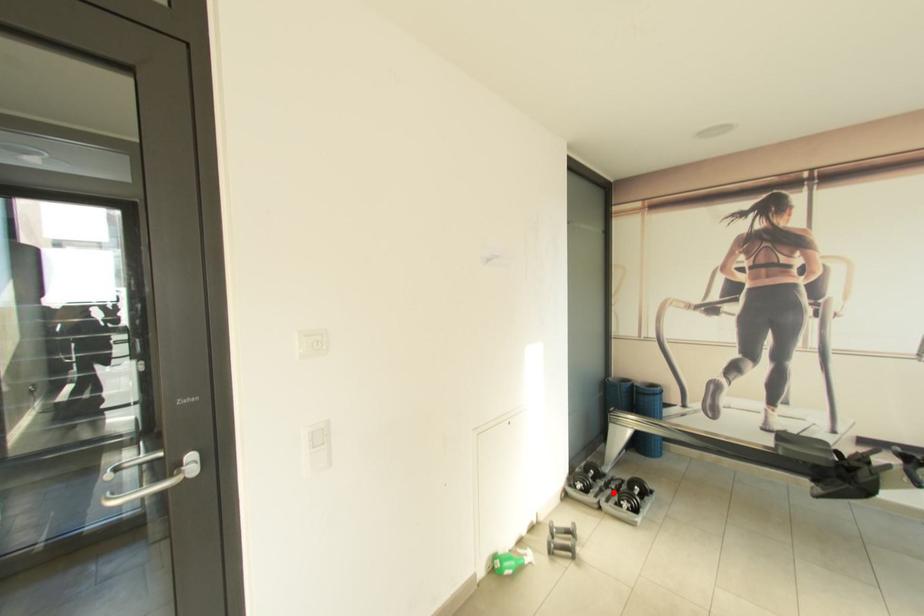
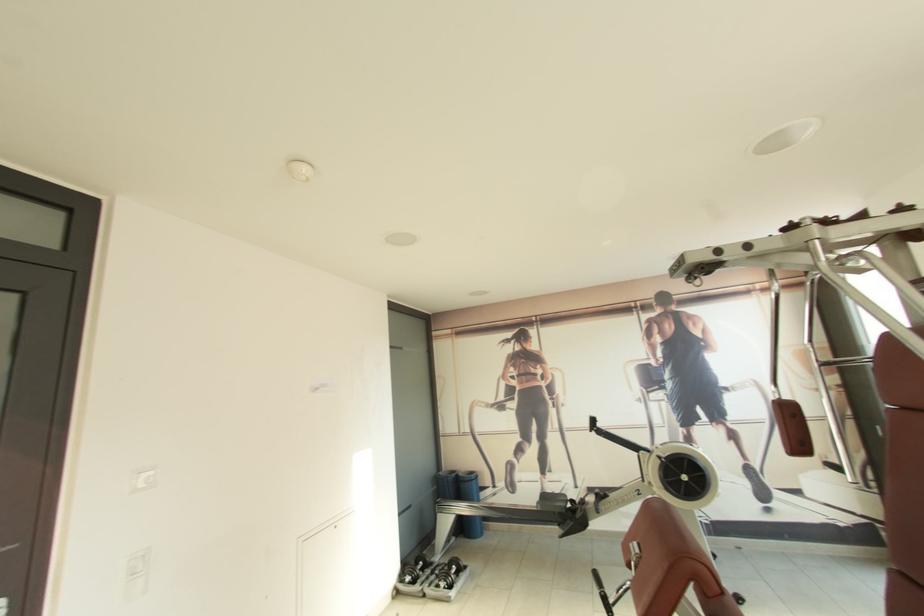
Question: A red point is marked in image1. In image2, is the corresponding 3D point closer to the camera or farther? Reply with the corresponding letter.

Choices:
 (A) The corresponding 3D point is closer.
 (B) The corresponding 3D point is farther.

Answer: (A)